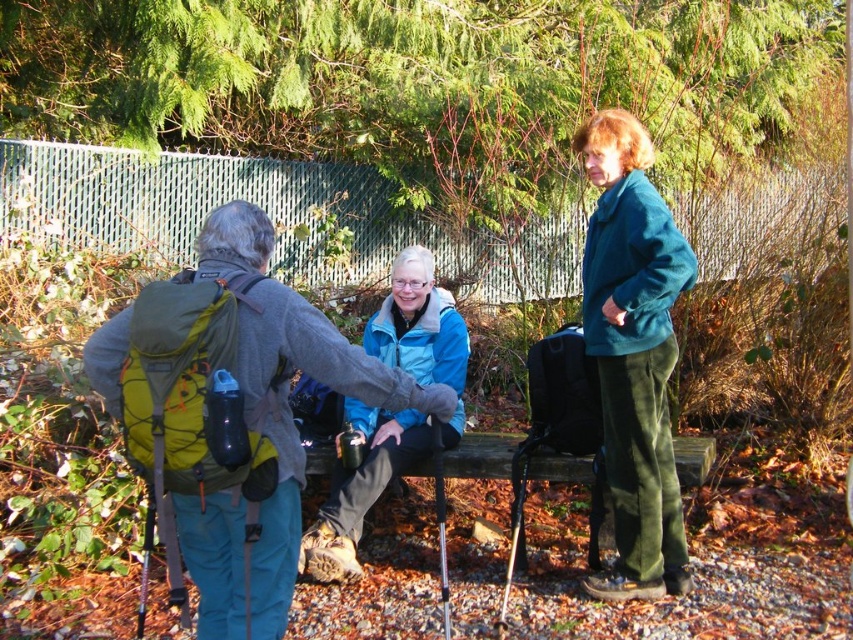
Can you confirm if green fabric backpack at left is wider than teal fleece jacket at upper right?

Indeed, green fabric backpack at left has a greater width compared to teal fleece jacket at upper right.

Does point (224, 243) come in front of point (648, 483)?

That is True.

Is point (126, 432) more distant than point (612, 356)?

No.

Where is `green fabric backpack at left`? The width and height of the screenshot is (853, 640). green fabric backpack at left is located at coordinates (241, 413).

Does green fabric backpack at left have a lesser height compared to blue fleece jacket at center?

Yes, green fabric backpack at left is shorter than blue fleece jacket at center.

Can you confirm if green fabric backpack at left is positioned to the left of blue fleece jacket at center?

Yes, green fabric backpack at left is to the left of blue fleece jacket at center.

This screenshot has width=853, height=640. I want to click on green fabric backpack at left, so click(x=241, y=413).

Is teal fleece jacket at upper right bigger than blue fleece jacket at center?

No.

Between point (660, 348) and point (405, 260), which one is positioned behind?

Positioned behind is point (405, 260).

Between point (602, 266) and point (341, 560), which one is positioned behind?

Point (341, 560)

I want to click on teal fleece jacket at upper right, so click(x=633, y=355).